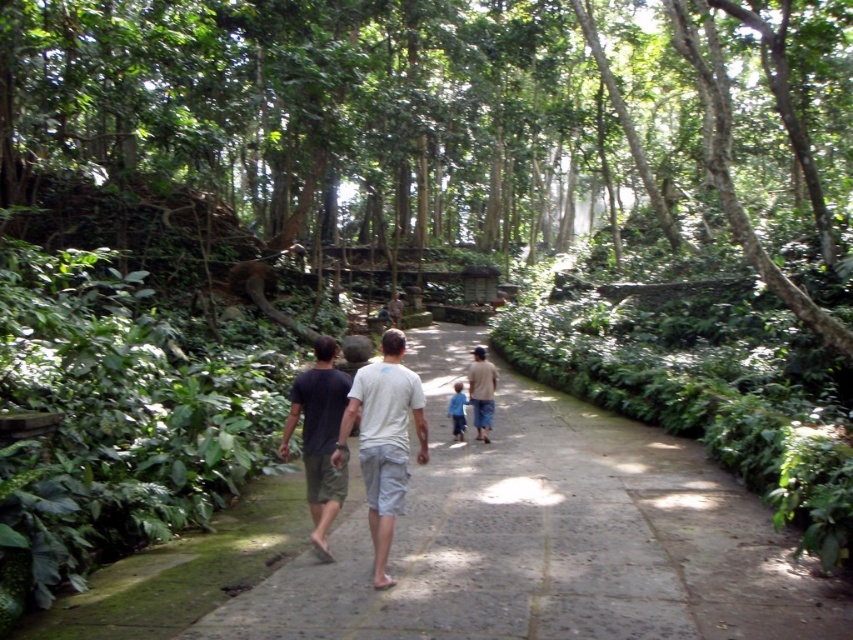
Question: Among these points, which one is farthest from the camera?

Choices:
 (A) (119, 179)
 (B) (316, 496)

Answer: (A)

Question: Where is white cotton shirt at center located in relation to blue denim shorts at center in the image?

Choices:
 (A) right
 (B) left

Answer: (B)

Question: Which of the following is the farthest from the observer?

Choices:
 (A) (556, 83)
 (B) (305, 388)

Answer: (A)

Question: Does gray stone pavement at center come in front of black cotton t-shirt at center?

Choices:
 (A) no
 (B) yes

Answer: (B)

Question: Is gray stone pavement at center to the left of black cotton t-shirt at center from the viewer's perspective?

Choices:
 (A) no
 (B) yes

Answer: (A)

Question: Which of the following is the farthest from the observer?

Choices:
 (A) (306, 468)
 (B) (479, 348)
 (C) (602, 522)

Answer: (B)